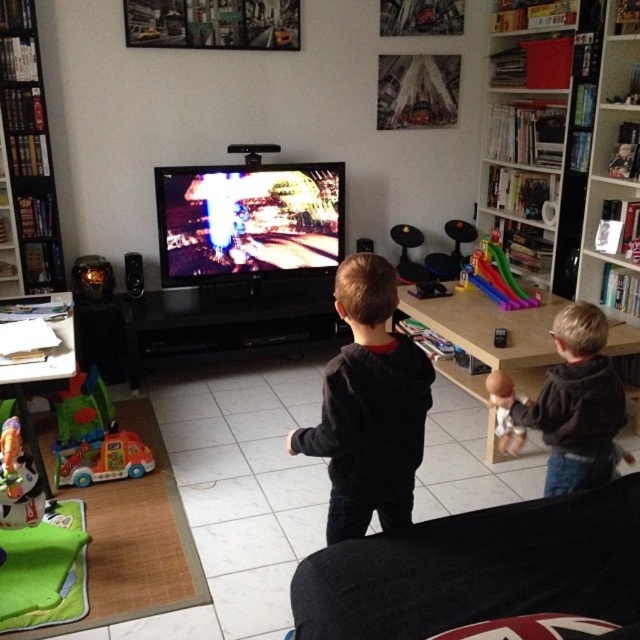
Does dark gray sweater at center have a greater width compared to black plastic bookshelf at left?

Yes, dark gray sweater at center is wider than black plastic bookshelf at left.

Is dark gray sweater at center thinner than black plastic bookshelf at left?

In fact, dark gray sweater at center might be wider than black plastic bookshelf at left.

Which is in front, point (355, 390) or point (32, 150)?

Point (355, 390) is more forward.

Find the location of `dark gray sweater at center`. dark gray sweater at center is located at coordinates (369, 406).

Is black glossy entertainment center at center thinner than black plastic bookshelf at left?

Incorrect, black glossy entertainment center at center's width is not less than black plastic bookshelf at left's.

Is black glossy entertainment center at center smaller than black plastic bookshelf at left?

No, black glossy entertainment center at center is not smaller than black plastic bookshelf at left.

Find the location of a particular element. Image resolution: width=640 pixels, height=640 pixels. black glossy entertainment center at center is located at coordinates [x=228, y=268].

Measure the distance between dark gray hoodie at center and multicolored plastic toy truck at lower left.

The distance of dark gray hoodie at center from multicolored plastic toy truck at lower left is 2.02 meters.

Measure the distance between point [584,371] and camera.

Point [584,371] and camera are 2.10 meters apart from each other.

Find the location of `dark gray hoodie at center`. dark gray hoodie at center is located at coordinates (577, 404).